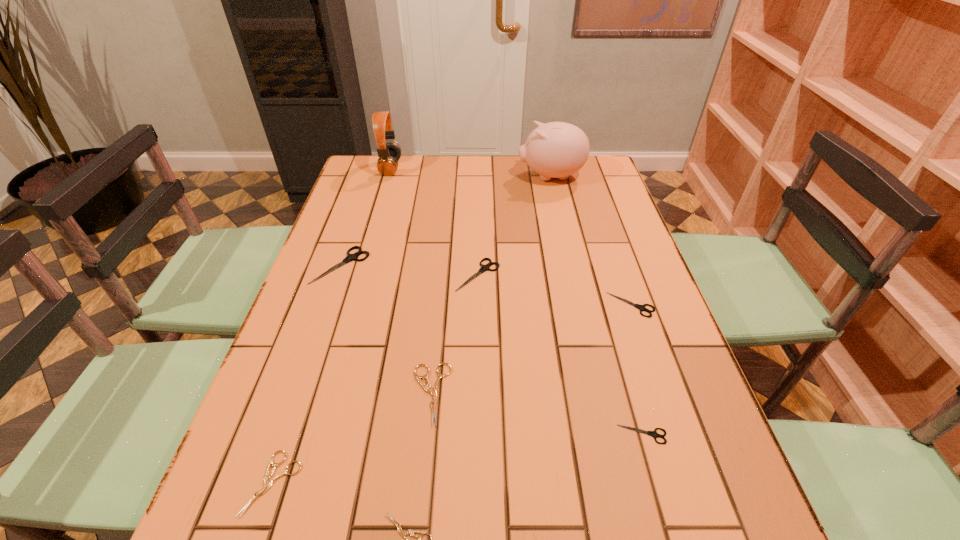
The width and height of the screenshot is (960, 540). I want to click on vacant space at the far right corner of the desktop, so click(x=590, y=184).

This screenshot has width=960, height=540. I want to click on vacant area between the headset and the nearest black shears, so click(x=516, y=301).

Where is `blank region between the piggy bank and the headset`? The width and height of the screenshot is (960, 540). blank region between the piggy bank and the headset is located at coordinates 470,172.

Where is `vacant area that lies between the third farthest black shears and the piggy bank`? The height and width of the screenshot is (540, 960). vacant area that lies between the third farthest black shears and the piggy bank is located at coordinates (591, 240).

The height and width of the screenshot is (540, 960). Identify the location of free point between the seventh shortest object and the biggest beige shears. (386, 329).

Find the location of `free space that is in between the smallest black shears and the brown headset`. free space that is in between the smallest black shears and the brown headset is located at coordinates (516, 301).

The width and height of the screenshot is (960, 540). Identify the location of free space between the headset and the piggy bank. (470, 172).

Find the location of a particular element. This screenshot has height=540, width=960. free area in between the brown headset and the smallest black shears is located at coordinates (516, 301).

What are the coordinates of `free point between the leftmost black shears and the biggest beige shears` in the screenshot? It's located at (386, 329).

Image resolution: width=960 pixels, height=540 pixels. Identify the location of object that ranks as the third closest to the second tallest shears. [641, 307].